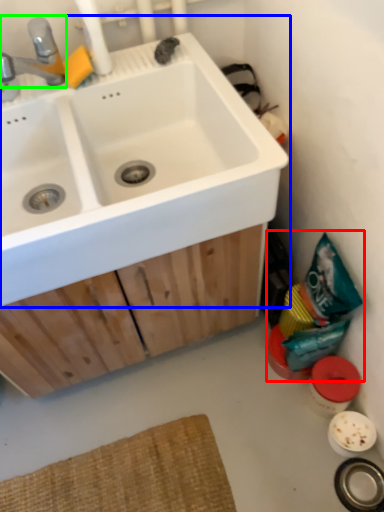
Question: Based on their relative distances, which object is farther from garbage (highlighted by a red box)? Choose from sink (highlighted by a blue box) and tap (highlighted by a green box).

Choices:
 (A) sink
 (B) tap

Answer: (B)